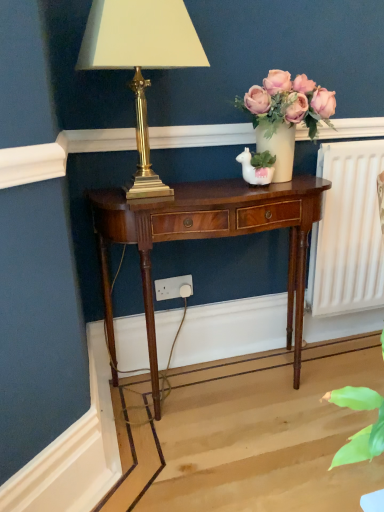
Question: Is matte white vase at upper right smaller than white plastic power outlet at lower center?

Choices:
 (A) yes
 (B) no

Answer: (B)

Question: From the image's perspective, is matte white vase at upper right under white plastic power outlet at lower center?

Choices:
 (A) yes
 (B) no

Answer: (B)

Question: Does matte white vase at upper right have a greater width compared to white plastic power outlet at lower center?

Choices:
 (A) yes
 (B) no

Answer: (A)

Question: Is matte white vase at upper right completely or partially outside of white plastic power outlet at lower center?

Choices:
 (A) yes
 (B) no

Answer: (A)

Question: From the image's perspective, is matte white vase at upper right above white plastic power outlet at lower center?

Choices:
 (A) no
 (B) yes

Answer: (B)

Question: Considering the relative sizes of matte white vase at upper right and white plastic power outlet at lower center in the image provided, is matte white vase at upper right thinner than white plastic power outlet at lower center?

Choices:
 (A) no
 (B) yes

Answer: (A)

Question: Considering the relative sizes of gold brass lamp at upper left and matte white vase at upper right in the image provided, is gold brass lamp at upper left taller than matte white vase at upper right?

Choices:
 (A) yes
 (B) no

Answer: (A)

Question: Considering the relative sizes of gold brass lamp at upper left and matte white vase at upper right in the image provided, is gold brass lamp at upper left shorter than matte white vase at upper right?

Choices:
 (A) no
 (B) yes

Answer: (A)

Question: Can matte white vase at upper right be found inside gold brass lamp at upper left?

Choices:
 (A) no
 (B) yes

Answer: (A)

Question: From a real-world perspective, is gold brass lamp at upper left on matte white vase at upper right?

Choices:
 (A) yes
 (B) no

Answer: (A)

Question: Is the depth of gold brass lamp at upper left less than that of matte white vase at upper right?

Choices:
 (A) yes
 (B) no

Answer: (A)

Question: Is gold brass lamp at upper left smaller than matte white vase at upper right?

Choices:
 (A) yes
 (B) no

Answer: (B)

Question: Does white plastic power outlet at lower center have a lesser width compared to gold brass lamp at upper left?

Choices:
 (A) no
 (B) yes

Answer: (B)